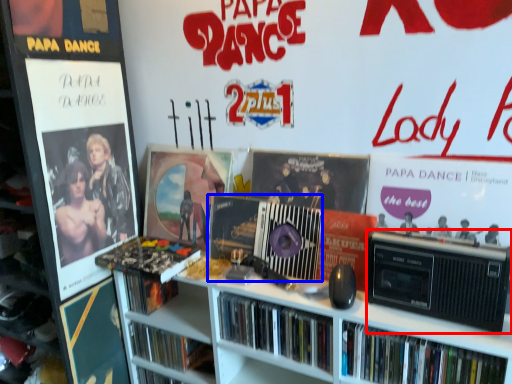
Question: Which object appears closest to the camera in this image, cassette (highlighted by a red box) or cassette (highlighted by a blue box)?

Choices:
 (A) cassette
 (B) cassette

Answer: (A)